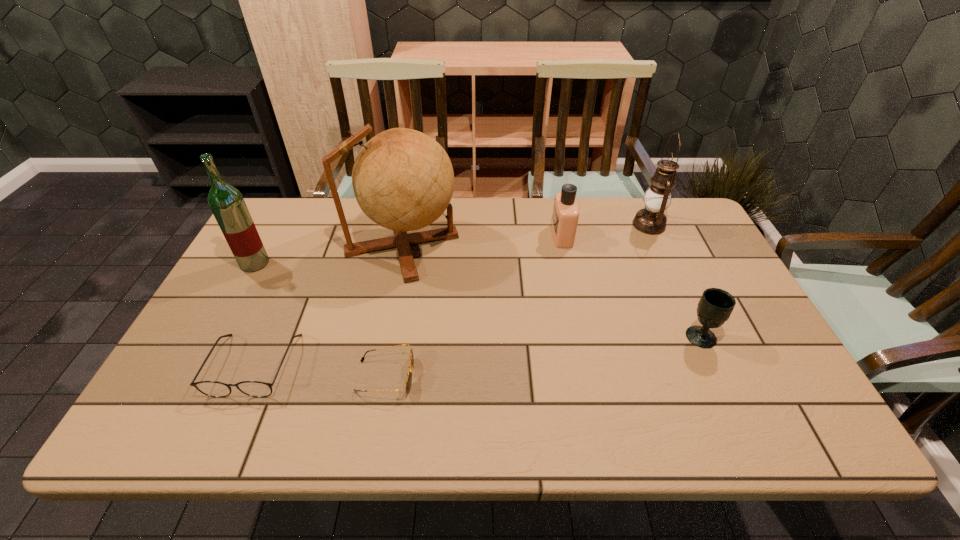
Locate which object ranks fourth in proximity to the oil lamp. Please provide its 2D coordinates. Your answer should be formatted as a tuple, i.e. [(x, y)], where the tuple contains the x and y coordinates of a point satisfying the conditions above.

[(409, 375)]

The height and width of the screenshot is (540, 960). I want to click on object that can be found as the closest to the shortest object, so coord(217,389).

Find the location of a particular element. free space that satisfies the following two spatial constraints: 1. on the front side of the chalice; 2. on the left side of the liquor is located at coordinates 215,336.

This screenshot has height=540, width=960. I want to click on vacant point that satisfies the following two spatial constraints: 1. on the front label of the chalice; 2. on the right side of the fourth tallest object, so click(584, 336).

You are a GUI agent. You are given a task and a screenshot of the screen. Output one action in this format:
    pyautogui.click(x=<x>, y=<y>)
    Task: Click on the vacant point that satisfies the following two spatial constraints: 1. on the front side of the chalice; 2. on the lenses of the shortest object
    The width and height of the screenshot is (960, 540).
    Given the screenshot: What is the action you would take?
    pyautogui.click(x=719, y=376)